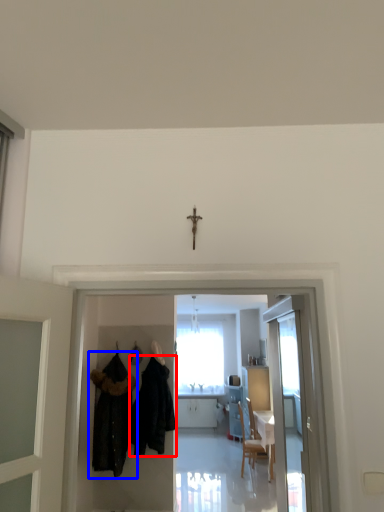
Question: Which object is further to the camera taking this photo, fancy dress (highlighted by a red box) or fancy dress (highlighted by a blue box)?

Choices:
 (A) fancy dress
 (B) fancy dress

Answer: (A)